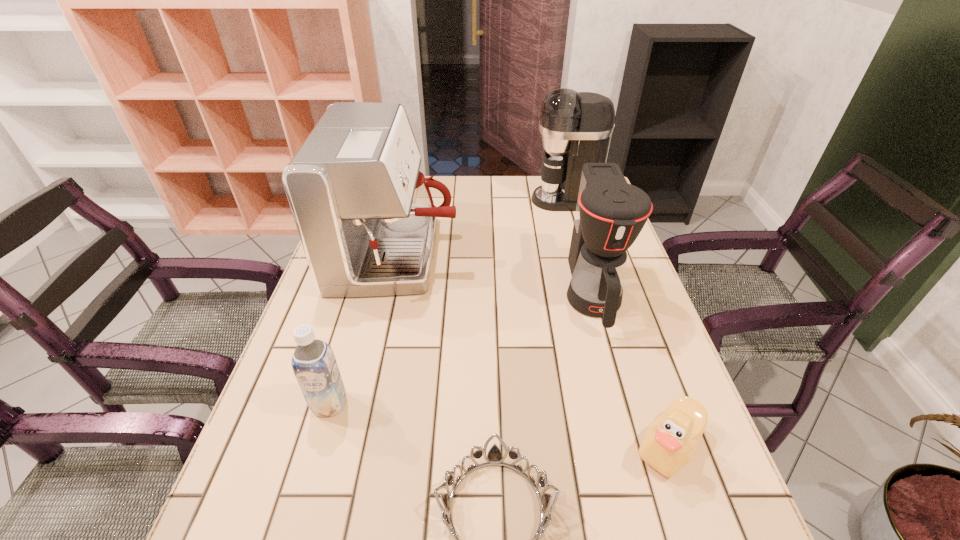
This screenshot has width=960, height=540. I want to click on the second closest coffee maker to the farthest coffee maker, so click(x=610, y=213).

Locate an element on the screen. The image size is (960, 540). free location that satisfies the following two spatial constraints: 1. on the front of the leftmost coffee maker near the spout; 2. on the label of the soya milk is located at coordinates (363, 404).